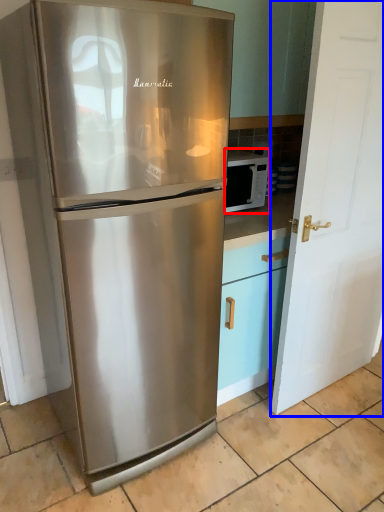
Question: Among these objects, which one is nearest to the camera, microwave oven (highlighted by a red box) or door (highlighted by a blue box)?

Choices:
 (A) microwave oven
 (B) door

Answer: (B)